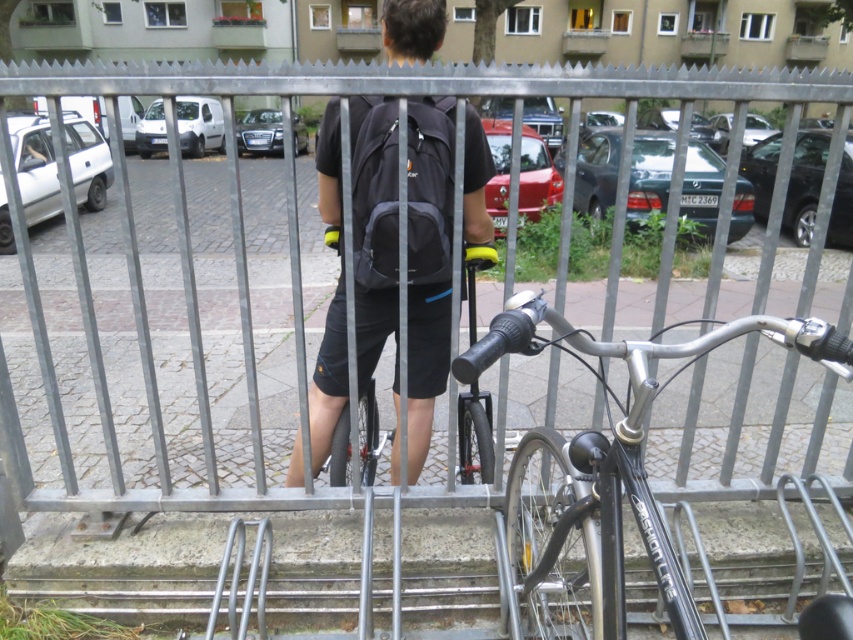
Does metallic silver fence at center have a greater height compared to matte black backpack at center?

Incorrect, metallic silver fence at center's height is not larger of matte black backpack at center's.

Which is in front, point (169, 508) or point (430, 33)?

Point (430, 33) is in front.

Locate an element on the screen. Image resolution: width=853 pixels, height=640 pixels. metallic silver fence at center is located at coordinates point(247,248).

Is the position of metallic silver fence at center more distant than that of shiny metallic bicycle at center?

Yes, it is.

What do you see at coordinates (247, 248) in the screenshot? I see `metallic silver fence at center` at bounding box center [247, 248].

This screenshot has width=853, height=640. Describe the element at coordinates (247, 248) in the screenshot. I see `metallic silver fence at center` at that location.

Locate an element on the screen. The height and width of the screenshot is (640, 853). metallic silver fence at center is located at coordinates (247, 248).

Consider the image. Is shiny metallic bicycle at center closer to camera compared to matte black backpack at center?

Yes, it is in front of matte black backpack at center.

Between shiny metallic bicycle at center and matte black backpack at center, which one is positioned lower?

shiny metallic bicycle at center is below.

Find the location of a particular element. Image resolution: width=853 pixels, height=640 pixels. shiny metallic bicycle at center is located at coordinates (605, 474).

Locate an element on the screen. shiny metallic bicycle at center is located at coordinates (605, 474).